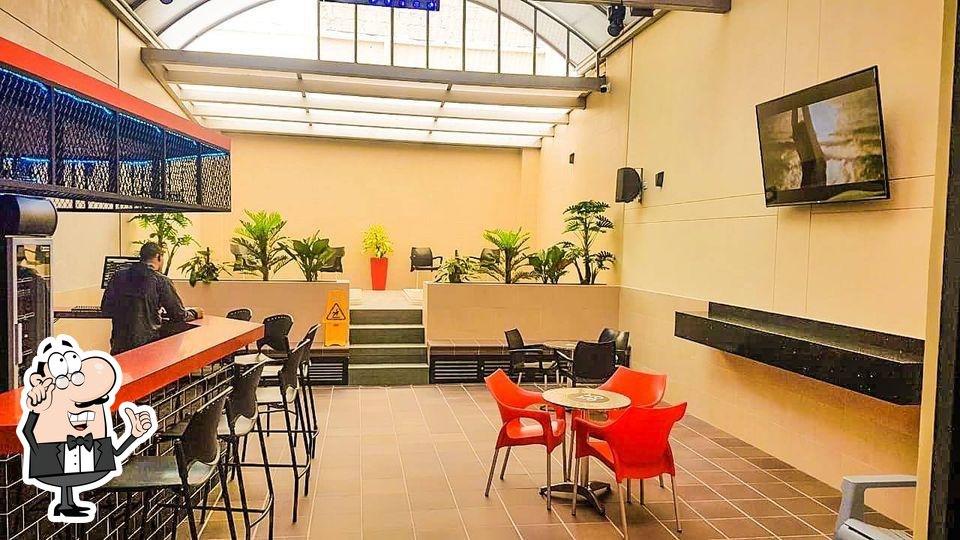
Where is `black chairs`? This screenshot has width=960, height=540. black chairs is located at coordinates (208, 426), (238, 397), (290, 370).